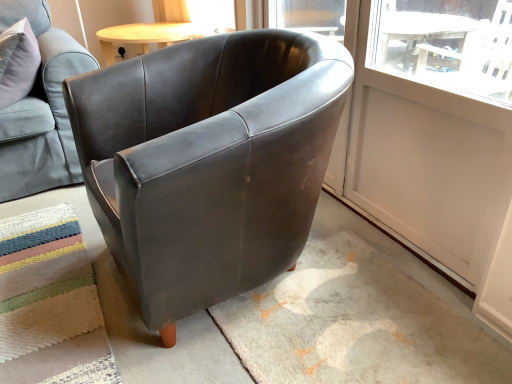
Question: Is matte leather armchair at upper left, acting as the first chair starting from the left, taller or shorter than multicolored woven mat at lower left?

Choices:
 (A) short
 (B) tall

Answer: (B)

Question: Is point (37, 28) closer or farther from the camera than point (74, 372)?

Choices:
 (A) farther
 (B) closer

Answer: (A)

Question: Based on their relative distances, which object is nearer to the white matte screen door at upper right?

Choices:
 (A) multicolored woven mat at lower left
 (B) matte leather armchair at upper left, which ranks as the 2th chair in right-to-left order
 (C) matte black armchair at center, arranged as the 2th chair when viewed from the left

Answer: (C)

Question: Which object is the closest to the matte leather armchair at upper left, which ranks as the 2th chair in right-to-left order?

Choices:
 (A) white matte screen door at upper right
 (B) matte black armchair at center, the 1th chair when ordered from right to left
 (C) multicolored woven mat at lower left

Answer: (C)